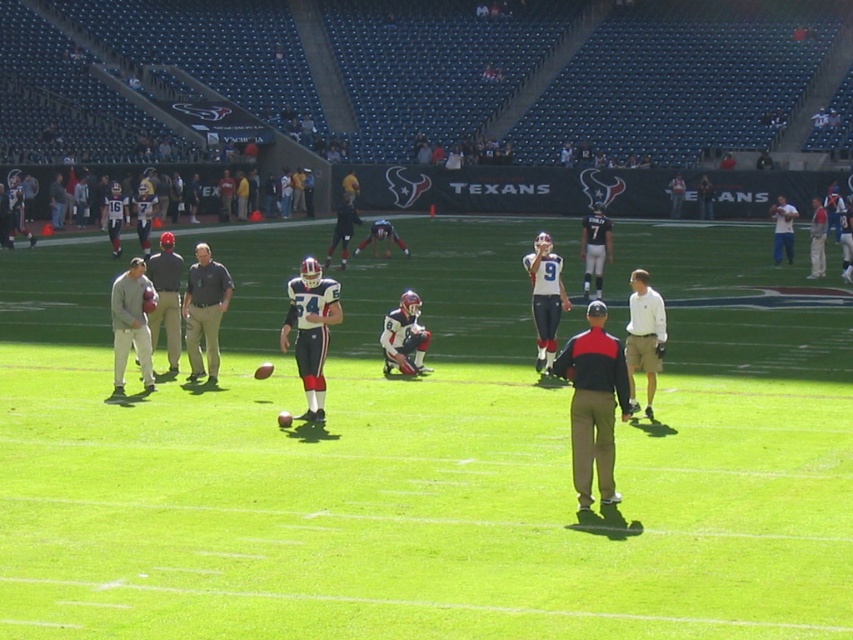
Is white cotton shirt at center wider than black jersey at center?

No, white cotton shirt at center is not wider than black jersey at center.

From the picture: Which is more to the left, white cotton shirt at center or black jersey at center?

From the viewer's perspective, white cotton shirt at center appears more on the left side.

The image size is (853, 640). Find the location of `white cotton shirt at center`. white cotton shirt at center is located at coordinates click(x=643, y=336).

Between green grass field at center and white cotton shirt at center, which one appears on the left side from the viewer's perspective?

green grass field at center

Can you confirm if green grass field at center is positioned to the right of white cotton shirt at center?

In fact, green grass field at center is to the left of white cotton shirt at center.

Measure the distance between point (39, 362) and camera.

Point (39, 362) is 17.07 meters from camera.

Identify the location of green grass field at center. The image size is (853, 640). (428, 452).

Does dark gray uniform at center appear on the left side of white uniform at center?

In fact, dark gray uniform at center is to the right of white uniform at center.

You are a GUI agent. You are given a task and a screenshot of the screen. Output one action in this format:
    pyautogui.click(x=<x>, y=<y>)
    Task: Click on the dark gray uniform at center
    Image resolution: width=853 pixels, height=640 pixels.
    Given the screenshot: What is the action you would take?
    pyautogui.click(x=204, y=310)

The height and width of the screenshot is (640, 853). What are the coordinates of `dark gray uniform at center` in the screenshot? It's located at (204, 310).